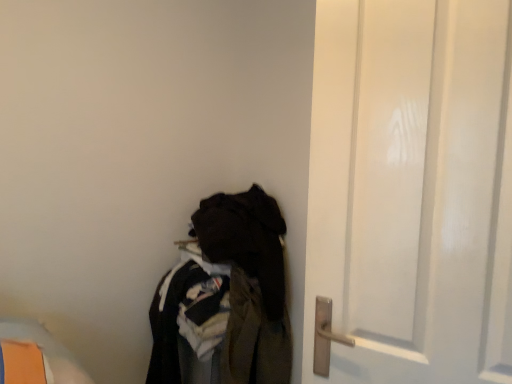
Question: Considering the positions of point (268, 347) and point (401, 246), is point (268, 347) closer or farther from the camera than point (401, 246)?

Choices:
 (A) closer
 (B) farther

Answer: (B)

Question: Looking at their shapes, would you say dark fabric clothes at lower left is wider or thinner than white matte door at right?

Choices:
 (A) thin
 (B) wide

Answer: (B)

Question: From a real-world perspective, is dark fabric clothes at lower left positioned above or below white matte door at right?

Choices:
 (A) above
 (B) below

Answer: (B)

Question: Considering the positions of white matte door at right and dark fabric clothes at lower left in the image, is white matte door at right bigger or smaller than dark fabric clothes at lower left?

Choices:
 (A) big
 (B) small

Answer: (B)

Question: Visually, is white matte door at right positioned to the left or to the right of dark fabric clothes at lower left?

Choices:
 (A) left
 (B) right

Answer: (B)

Question: Relative to dark fabric clothes at lower left, is white matte door at right in front or behind?

Choices:
 (A) front
 (B) behind

Answer: (A)

Question: From a real-world perspective, is white matte door at right physically located above or below dark fabric clothes at lower left?

Choices:
 (A) above
 (B) below

Answer: (A)